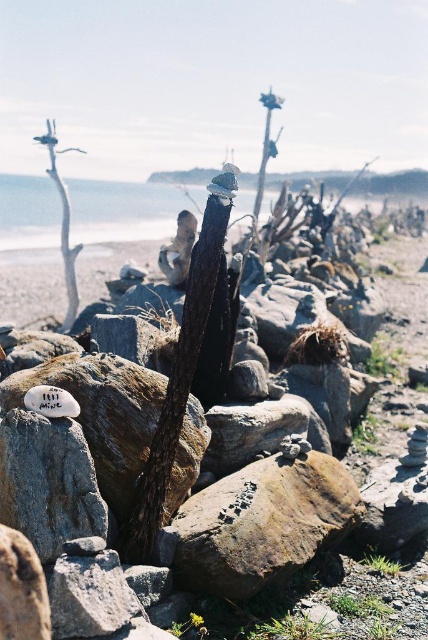
Question: Which of the following is the farthest from the observer?

Choices:
 (A) coord(259,99)
 (B) coord(235,576)

Answer: (A)

Question: Which is nearer to the smooth gray tree trunk at left?

Choices:
 (A) rough textured rock at center
 (B) smooth bark tree trunk at center

Answer: (B)

Question: Which of the following is the farthest from the observer?

Choices:
 (A) smooth bark tree trunk at center
 (B) smooth gray tree trunk at left
 (C) rough textured rock at center

Answer: (A)

Question: Does smooth gray tree trunk at left appear on the left side of smooth bark tree trunk at center?

Choices:
 (A) yes
 (B) no

Answer: (A)

Question: Can you confirm if rough textured rock at center is bigger than smooth gray tree trunk at left?

Choices:
 (A) yes
 (B) no

Answer: (B)

Question: Is rough textured rock at center further to camera compared to smooth gray tree trunk at left?

Choices:
 (A) no
 (B) yes

Answer: (A)